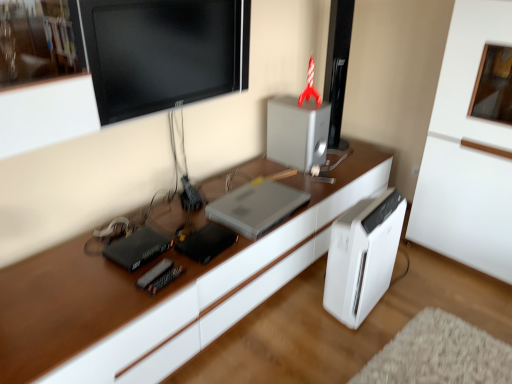
Where is `free point to the right of white plastic air purifier at lower right`? free point to the right of white plastic air purifier at lower right is located at coordinates (410, 302).